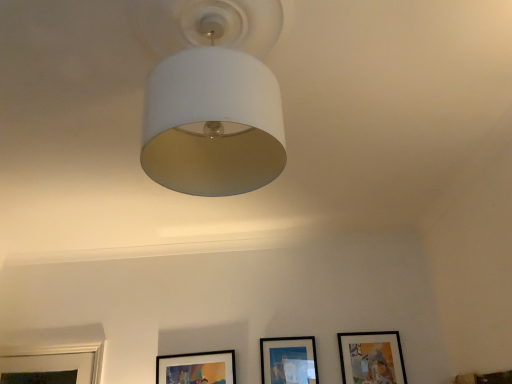
Question: Considering the relative sizes of matte black picture frame at lower center, marked as the 1th picture frame in a left-to-right arrangement, and matte black picture frame at center, the 2th picture frame in the right-to-left sequence, in the image provided, is matte black picture frame at lower center, marked as the 1th picture frame in a left-to-right arrangement, bigger than matte black picture frame at center, the 2th picture frame in the right-to-left sequence,?

Choices:
 (A) yes
 (B) no

Answer: (A)

Question: Is matte black picture frame at lower center, marked as the 1th picture frame in a left-to-right arrangement, shorter than matte black picture frame at center, the 2th picture frame positioned from the left?

Choices:
 (A) yes
 (B) no

Answer: (A)

Question: From a real-world perspective, is matte black picture frame at lower center, which is counted as the 3th picture frame, starting from the right, over matte black picture frame at center, the 2th picture frame in the right-to-left sequence?

Choices:
 (A) yes
 (B) no

Answer: (B)

Question: Does matte black picture frame at lower center, which is counted as the 3th picture frame, starting from the right, lie in front of matte black picture frame at center, the 2th picture frame in the right-to-left sequence?

Choices:
 (A) yes
 (B) no

Answer: (B)

Question: Is matte black picture frame at lower center, marked as the 1th picture frame in a left-to-right arrangement, far from matte black picture frame at center, the 2th picture frame in the right-to-left sequence?

Choices:
 (A) yes
 (B) no

Answer: (B)

Question: Relative to matte black picture frame at center, the 2th picture frame positioned from the left, is white matte lampshade at upper center in front or behind?

Choices:
 (A) behind
 (B) front

Answer: (B)

Question: In terms of width, does white matte lampshade at upper center look wider or thinner when compared to matte black picture frame at center, the 2th picture frame positioned from the left?

Choices:
 (A) thin
 (B) wide

Answer: (B)

Question: Based on their sizes in the image, would you say white matte lampshade at upper center is bigger or smaller than matte black picture frame at center, the 2th picture frame in the right-to-left sequence?

Choices:
 (A) big
 (B) small

Answer: (A)

Question: From a real-world perspective, is white matte lampshade at upper center physically located above or below matte black picture frame at center, the 2th picture frame positioned from the left?

Choices:
 (A) above
 (B) below

Answer: (A)

Question: Considering the positions of matte black picture frame at center, the 2th picture frame in the right-to-left sequence, and matte black picture frame at lower center, which is counted as the 3th picture frame, starting from the right, in the image, is matte black picture frame at center, the 2th picture frame in the right-to-left sequence, bigger or smaller than matte black picture frame at lower center, which is counted as the 3th picture frame, starting from the right,?

Choices:
 (A) small
 (B) big

Answer: (A)

Question: In terms of height, does matte black picture frame at center, the 2th picture frame in the right-to-left sequence, look taller or shorter compared to matte black picture frame at lower center, marked as the 1th picture frame in a left-to-right arrangement?

Choices:
 (A) short
 (B) tall

Answer: (B)

Question: Choose the correct answer: Is matte black picture frame at center, the 2th picture frame in the right-to-left sequence, inside matte black picture frame at lower center, marked as the 1th picture frame in a left-to-right arrangement, or outside it?

Choices:
 (A) inside
 (B) outside

Answer: (B)

Question: From a real-world perspective, is matte black picture frame at center, the 2th picture frame in the right-to-left sequence, positioned above or below matte black picture frame at lower center, marked as the 1th picture frame in a left-to-right arrangement?

Choices:
 (A) above
 (B) below

Answer: (A)

Question: Considering the positions of white matte lampshade at upper center and matte black picture frame at lower right, positioned as the 3th picture frame in left-to-right order, in the image, is white matte lampshade at upper center wider or thinner than matte black picture frame at lower right, positioned as the 3th picture frame in left-to-right order,?

Choices:
 (A) wide
 (B) thin

Answer: (A)

Question: Is point (220, 162) closer or farther from the camera than point (351, 374)?

Choices:
 (A) farther
 (B) closer

Answer: (B)